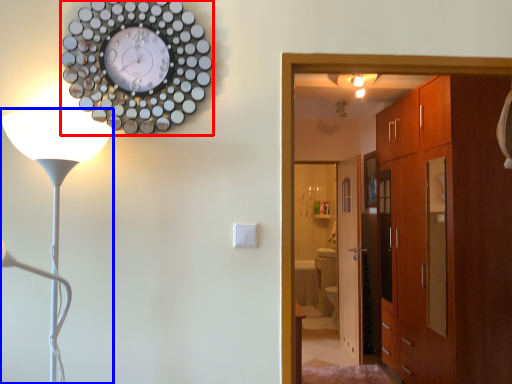
Question: Which of the following is the closest to the observer, wall clock (highlighted by a red box) or lamp (highlighted by a blue box)?

Choices:
 (A) wall clock
 (B) lamp

Answer: (B)